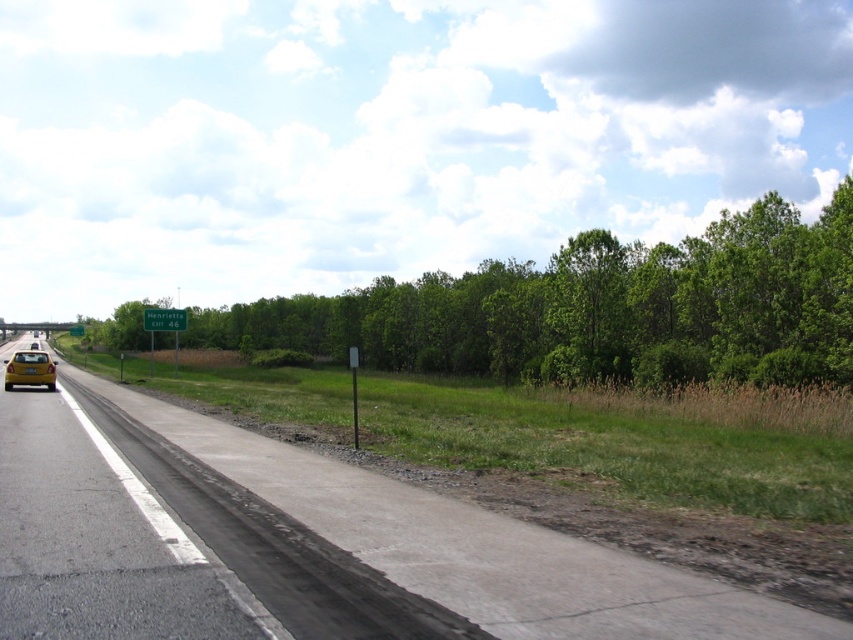
You are a driver approaching the asphalt road at center and the green leafy tree at upper center. Which object will you see first as you drive along the road?

The asphalt road at center will be seen first because it is located below the green leafy tree at upper center, meaning it is closer to the viewer along the driving path.

You are a driver approaching the highway and want to know the exact location of the green leafy tree at upper center. What are its coordinates?

The green leafy tree at upper center is located at coordinates point (596, 308).

You are driving a car that is 5.5 feet wide. You want to safely navigate through the asphalt road at center. What is the minimum width of the road needed to ensure your car can pass through without touching the sides?

The asphalt road at center is 14.75 feet away from the camera, but the question is about the road width. Since the provided information does not specify the road width, we cannot determine the minimum width needed for the car to pass safely.